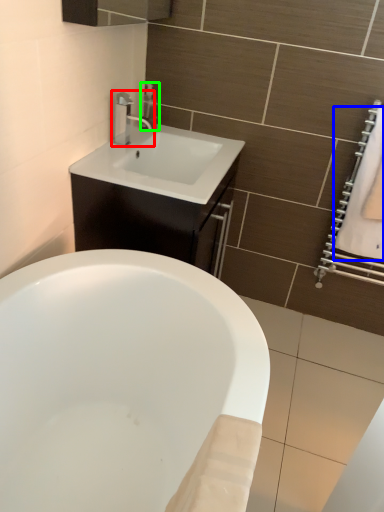
Question: Estimate the real-world distances between objects in this image. Which object is closer to tap (highlighted by a red box), bath towel (highlighted by a blue box) or soap dispenser (highlighted by a green box)?

Choices:
 (A) bath towel
 (B) soap dispenser

Answer: (B)